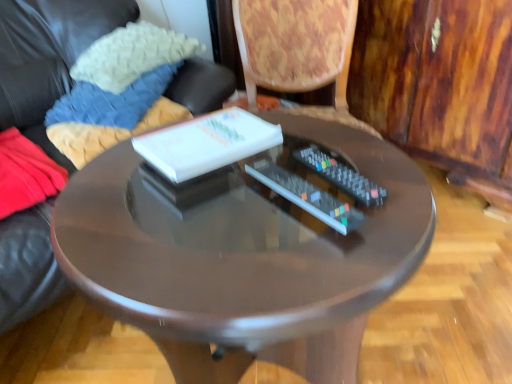
Question: Is black plastic remote at center, which is the second remote control from left to right, touching matte black remote control at center, the first remote control positioned from the left?

Choices:
 (A) no
 (B) yes

Answer: (B)

Question: Is black plastic remote at center, which is the second remote control from left to right, facing away from matte black remote control at center, positioned as the second remote control in right-to-left order?

Choices:
 (A) no
 (B) yes

Answer: (A)

Question: From a real-world perspective, is black plastic remote at center, which appears as the first remote control when viewed from the right, positioned over matte black remote control at center, positioned as the second remote control in right-to-left order, based on gravity?

Choices:
 (A) yes
 (B) no

Answer: (A)

Question: Is black plastic remote at center, which is the second remote control from left to right, not inside matte black remote control at center, positioned as the second remote control in right-to-left order?

Choices:
 (A) no
 (B) yes

Answer: (B)

Question: From a real-world perspective, is black plastic remote at center, which is the second remote control from left to right, beneath matte black remote control at center, positioned as the second remote control in right-to-left order?

Choices:
 (A) no
 (B) yes

Answer: (A)

Question: From the image's perspective, is white knitted pillow at upper left, which is the 1th pillow in top-to-bottom order, above or below glossy wood table at center?

Choices:
 (A) above
 (B) below

Answer: (A)

Question: From their relative heights in the image, would you say white knitted pillow at upper left, the 2th pillow from the bottom, is taller or shorter than glossy wood table at center?

Choices:
 (A) short
 (B) tall

Answer: (A)

Question: From a real-world perspective, relative to glossy wood table at center, is white knitted pillow at upper left, the 2th pillow from the bottom, vertically above or below?

Choices:
 (A) above
 (B) below

Answer: (A)

Question: Considering their positions, is white knitted pillow at upper left, the 2th pillow from the bottom, located in front of or behind glossy wood table at center?

Choices:
 (A) behind
 (B) front

Answer: (A)

Question: Is point pos(173,132) positioned closer to the camera than point pos(338,208)?

Choices:
 (A) farther
 (B) closer

Answer: (A)

Question: Is white glossy book at center wider or thinner than matte black remote control at center, positioned as the second remote control in right-to-left order?

Choices:
 (A) wide
 (B) thin

Answer: (B)

Question: From a real-world perspective, relative to matte black remote control at center, positioned as the second remote control in right-to-left order, is white glossy book at center vertically above or below?

Choices:
 (A) above
 (B) below

Answer: (A)

Question: Is white glossy book at center in front of or behind matte black remote control at center, the first remote control positioned from the left, in the image?

Choices:
 (A) front
 (B) behind

Answer: (B)

Question: Looking at the image, does soft woolen pillow at upper left, the first pillow from the bottom, seem bigger or smaller compared to white glossy book at center?

Choices:
 (A) big
 (B) small

Answer: (A)

Question: Relative to white glossy book at center, is soft woolen pillow at upper left, which is counted as the 2th pillow, starting from the top, in front or behind?

Choices:
 (A) behind
 (B) front

Answer: (A)